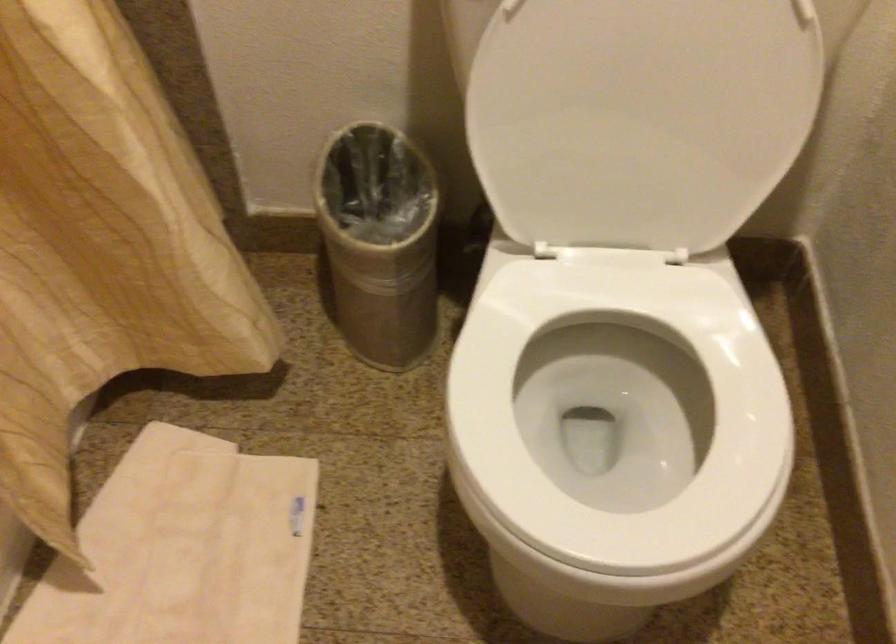
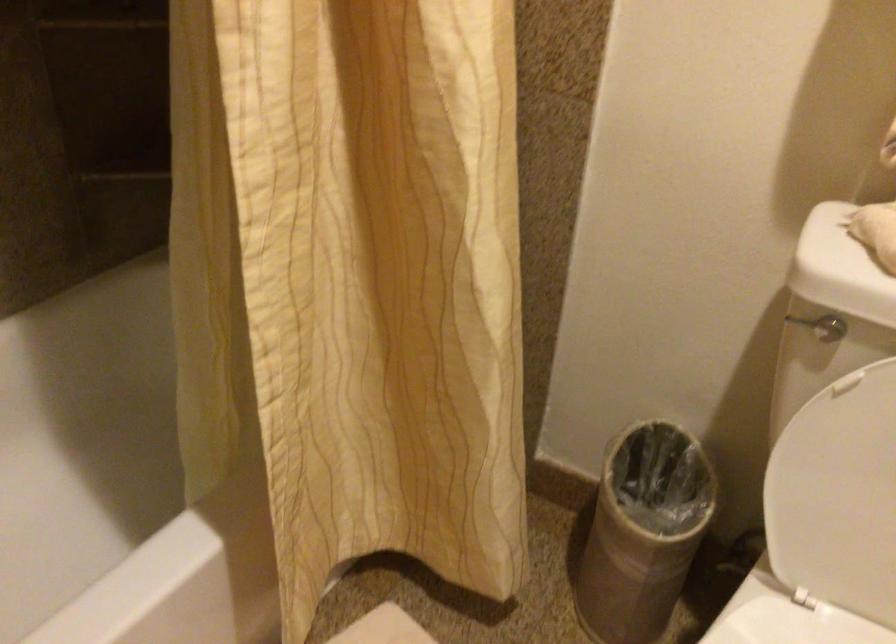
The point at (376, 247) is marked in the first image. Where is the corresponding point in the second image?

(643, 532)